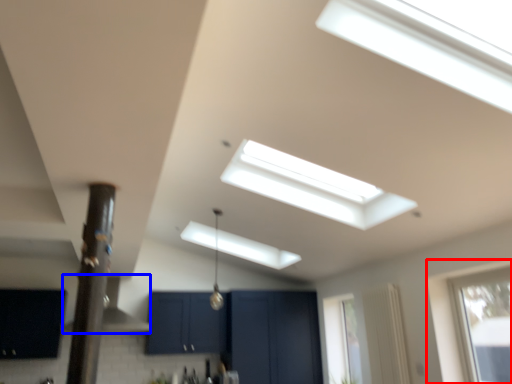
Question: Among these objects, which one is nearest to the camera, window (highlighted by a red box) or exhaust hood (highlighted by a blue box)?

Choices:
 (A) window
 (B) exhaust hood

Answer: (A)